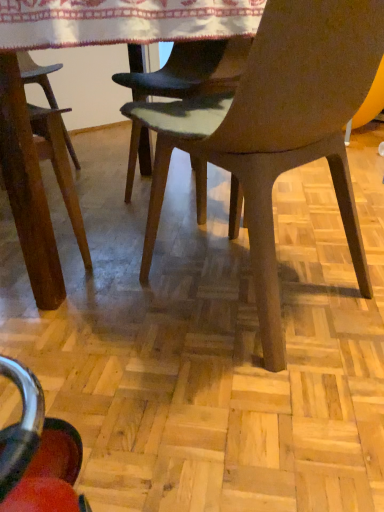
You are a GUI agent. You are given a task and a screenshot of the screen. Output one action in this format:
    pyautogui.click(x=<x>, y=<y>)
    Task: Click on the blank space to the left of matte brown chair at center
    
    Given the screenshot: What is the action you would take?
    pyautogui.click(x=102, y=298)